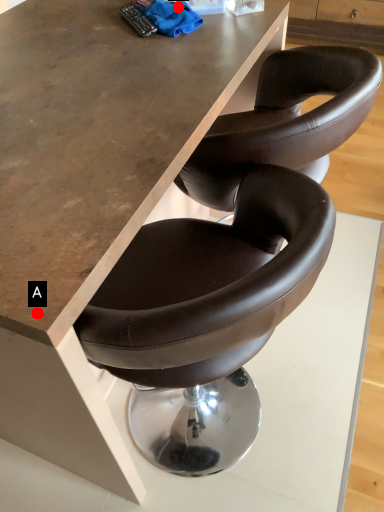
Question: Two points are circled on the image, labeled by A and B beside each circle. Which point is closer to the camera taking this photo?

Choices:
 (A) A is closer
 (B) B is closer

Answer: (A)